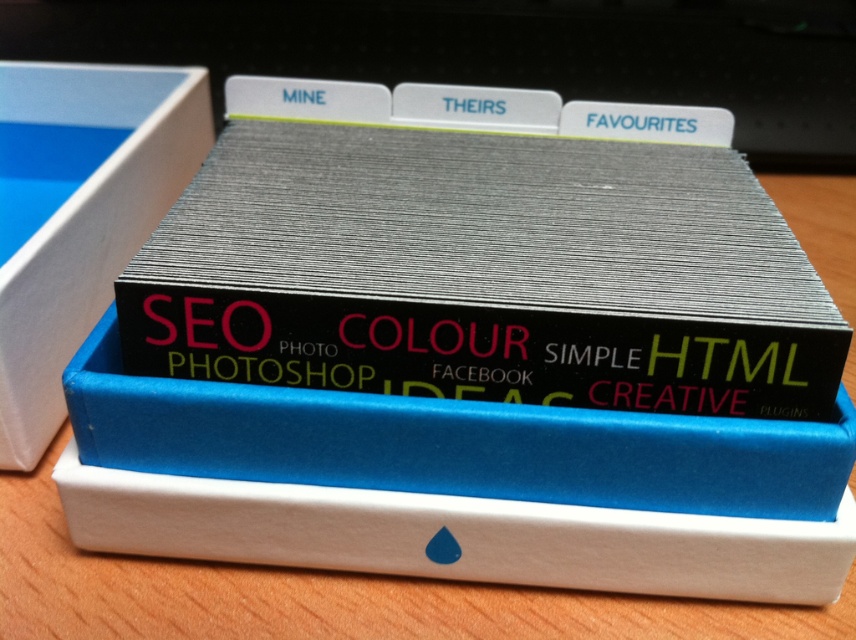
Question: Which point is closer to the camera?

Choices:
 (A) (177, 88)
 (B) (348, 304)

Answer: (B)

Question: Can you confirm if metallic silver book at center is smaller than white cardboard box at left?

Choices:
 (A) no
 (B) yes

Answer: (A)

Question: Among these points, which one is farthest from the camera?

Choices:
 (A) coord(342,269)
 (B) coord(188,154)

Answer: (B)

Question: Is metallic silver book at center below white cardboard box at left?

Choices:
 (A) yes
 (B) no

Answer: (A)

Question: Is metallic silver book at center wider than white cardboard box at left?

Choices:
 (A) no
 (B) yes

Answer: (B)

Question: Among these points, which one is nearest to the camera?

Choices:
 (A) (45, 221)
 (B) (296, 301)

Answer: (B)